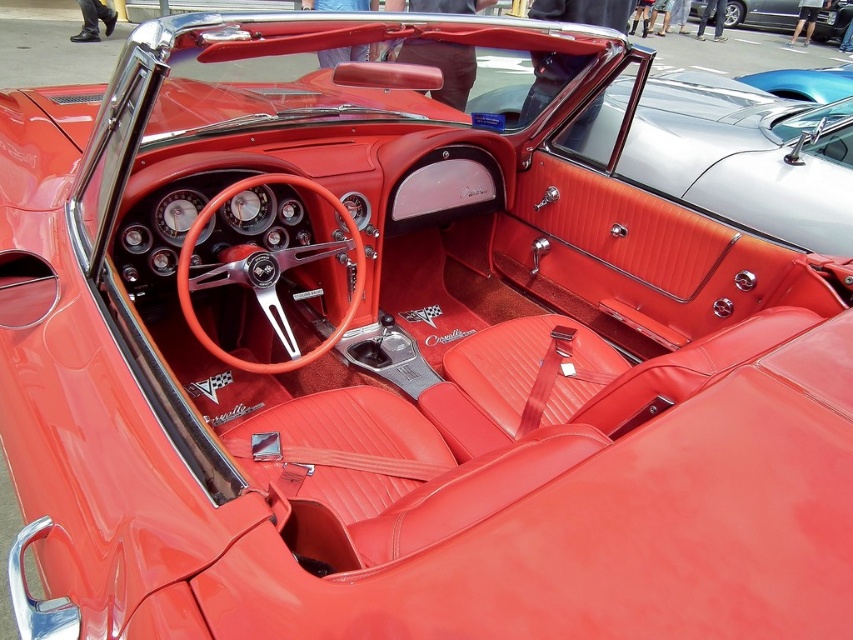
From the picture: Is matte red leather door at center to the left of glossy red leather convertible at upper center from the viewer's perspective?

Indeed, matte red leather door at center is positioned on the left side of glossy red leather convertible at upper center.

Looking at this image, does matte red leather door at center appear on the right side of glossy red leather convertible at upper center?

Incorrect, matte red leather door at center is not on the right side of glossy red leather convertible at upper center.

What do you see at coordinates (746, 156) in the screenshot? This screenshot has width=853, height=640. I see `matte red leather door at center` at bounding box center [746, 156].

The image size is (853, 640). I want to click on matte red leather door at center, so click(746, 156).